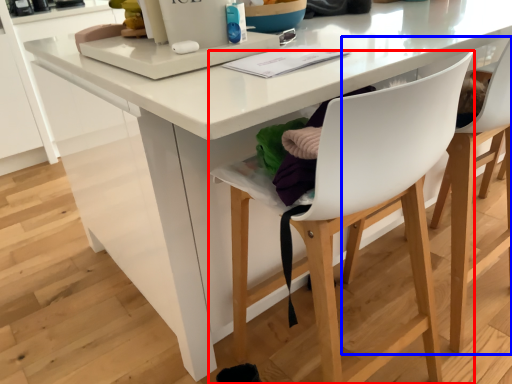
Question: Which object appears farthest to the camera in this image, chair (highlighted by a red box) or chair (highlighted by a blue box)?

Choices:
 (A) chair
 (B) chair

Answer: (B)